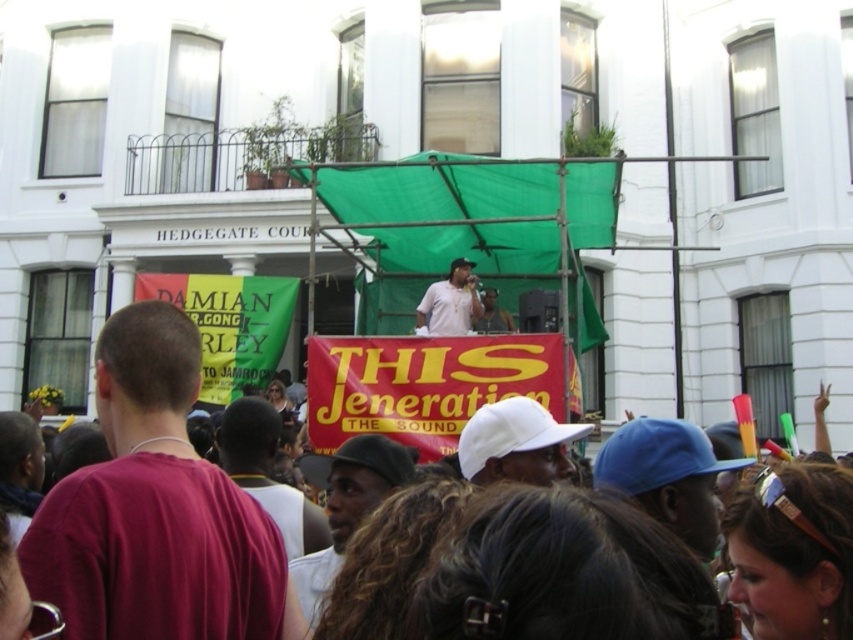
Question: Which point is farther to the camera?

Choices:
 (A) dark brown leather jacket at center
 (B) white matte baseball cap at center
 (C) blue matte baseball cap at center

Answer: (B)

Question: Is maroon t-shirt at center positioned before white matte shirt at center?

Choices:
 (A) yes
 (B) no

Answer: (A)

Question: Can you confirm if maroon t-shirt at center is wider than dark skin textured cap at center?

Choices:
 (A) yes
 (B) no

Answer: (A)

Question: Can you confirm if maroon t-shirt at center is wider than white matte baseball cap at center?

Choices:
 (A) no
 (B) yes

Answer: (B)

Question: Which point is farther to the camera?

Choices:
 (A) (331, 500)
 (B) (456, 298)

Answer: (B)

Question: Which of these objects is positioned farthest from the matte white shirt at center?

Choices:
 (A) maroon t-shirt at center
 (B) dark brown leather jacket at center
 (C) white matte shirt at center
 (D) blue matte baseball cap at center

Answer: (A)